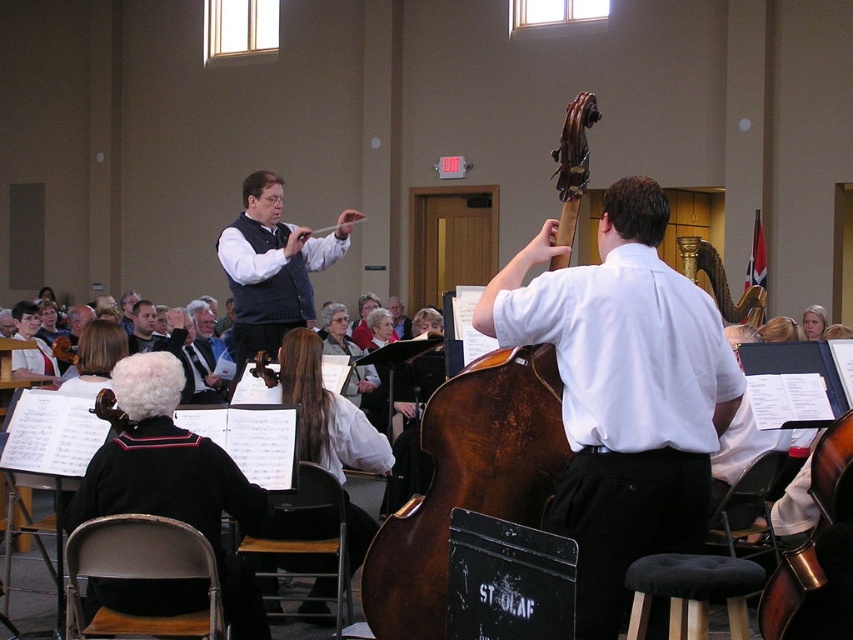
Can you confirm if dark brown wood cello at center is shorter than dark brown polished wood cello at lower right?

Incorrect, dark brown wood cello at center's height does not fall short of dark brown polished wood cello at lower right's.

Who is more distant from viewer, (546, 355) or (827, 544)?

The point (546, 355) is behind.

This screenshot has width=853, height=640. Identify the location of dark brown wood cello at center. (466, 481).

Is dark brown polished wood cello at lower right wider than dark brown fabric stool at lower center?

No, dark brown polished wood cello at lower right is not wider than dark brown fabric stool at lower center.

Is point (825, 481) farther from camera compared to point (697, 557)?

Yes, it is behind point (697, 557).

What are the coordinates of `dark brown polished wood cello at lower right` in the screenshot? It's located at (817, 554).

Does point (297, 378) come farther from viewer compared to point (836, 508)?

Yes, point (297, 378) is behind point (836, 508).

In the scene shown: Who is higher up, white fabric coat at center or dark brown polished wood cello at lower right?

white fabric coat at center is higher up.

Which is in front, point (285, 556) or point (787, 632)?

Point (787, 632) is more forward.

Find the location of a particular element. white fabric coat at center is located at coordinates (322, 410).